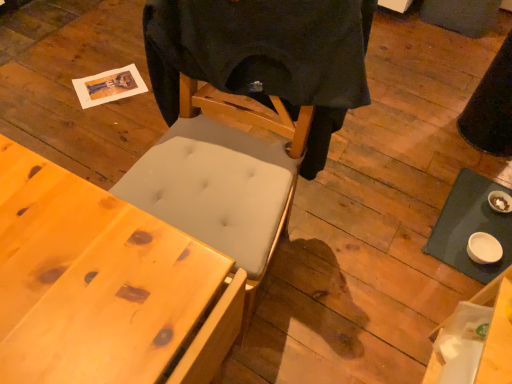
Question: Is white matte table at lower right smaller than wooden desk at lower left?

Choices:
 (A) no
 (B) yes

Answer: (B)

Question: From the image's perspective, is white matte table at lower right located beneath wooden desk at lower left?

Choices:
 (A) no
 (B) yes

Answer: (A)

Question: Is white matte table at lower right at the left side of wooden desk at lower left?

Choices:
 (A) yes
 (B) no

Answer: (B)

Question: Is white matte table at lower right wider than wooden desk at lower left?

Choices:
 (A) yes
 (B) no

Answer: (B)

Question: Is white matte table at lower right next to wooden desk at lower left?

Choices:
 (A) yes
 (B) no

Answer: (B)

Question: Is white matte table at lower right thinner than wooden desk at lower left?

Choices:
 (A) no
 (B) yes

Answer: (B)

Question: Can you confirm if white matte table at lower right is taller than black matte t-shirt at center?

Choices:
 (A) yes
 (B) no

Answer: (B)

Question: Is the position of white matte table at lower right less distant than that of black matte t-shirt at center?

Choices:
 (A) yes
 (B) no

Answer: (B)

Question: Is white matte table at lower right at the left side of black matte t-shirt at center?

Choices:
 (A) yes
 (B) no

Answer: (B)

Question: Can you confirm if white matte table at lower right is positioned to the right of black matte t-shirt at center?

Choices:
 (A) no
 (B) yes

Answer: (B)

Question: Is white matte table at lower right looking in the opposite direction of black matte t-shirt at center?

Choices:
 (A) no
 (B) yes

Answer: (A)

Question: From the image's perspective, is white matte table at lower right over black matte t-shirt at center?

Choices:
 (A) yes
 (B) no

Answer: (B)

Question: Would you consider black matte t-shirt at center to be distant from white matte table at lower right?

Choices:
 (A) yes
 (B) no

Answer: (B)